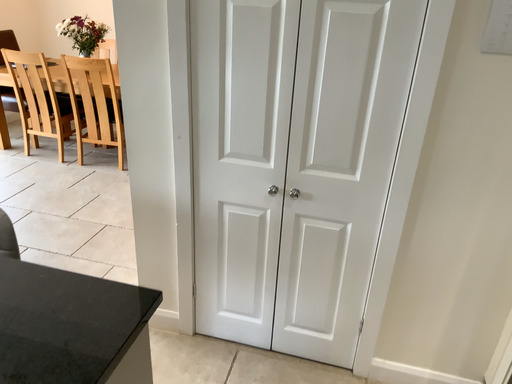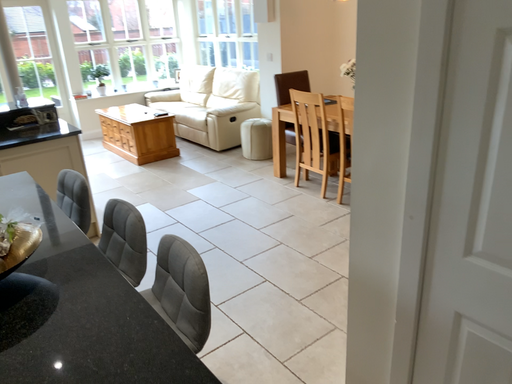
Question: Which way did the camera rotate in the video?

Choices:
 (A) rotated right
 (B) rotated left

Answer: (B)